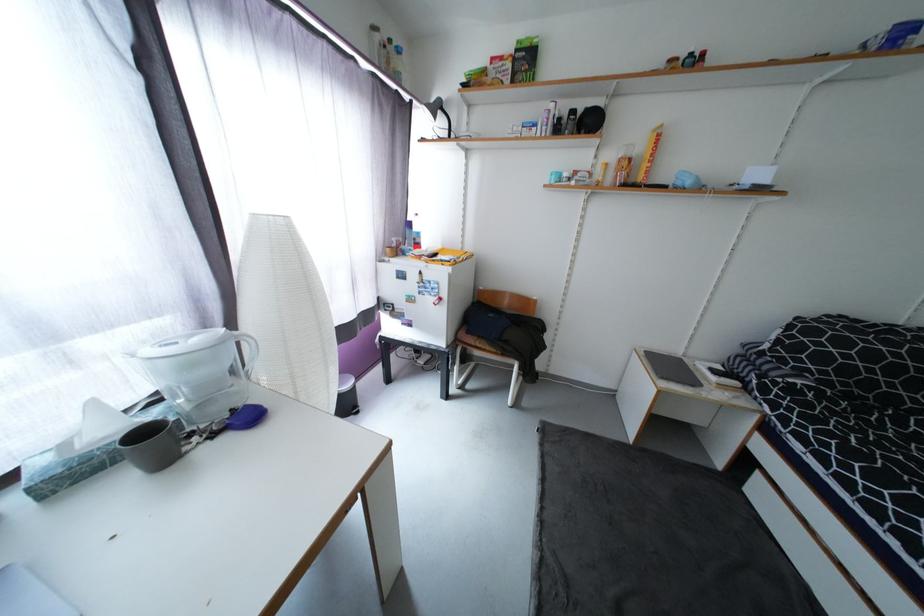
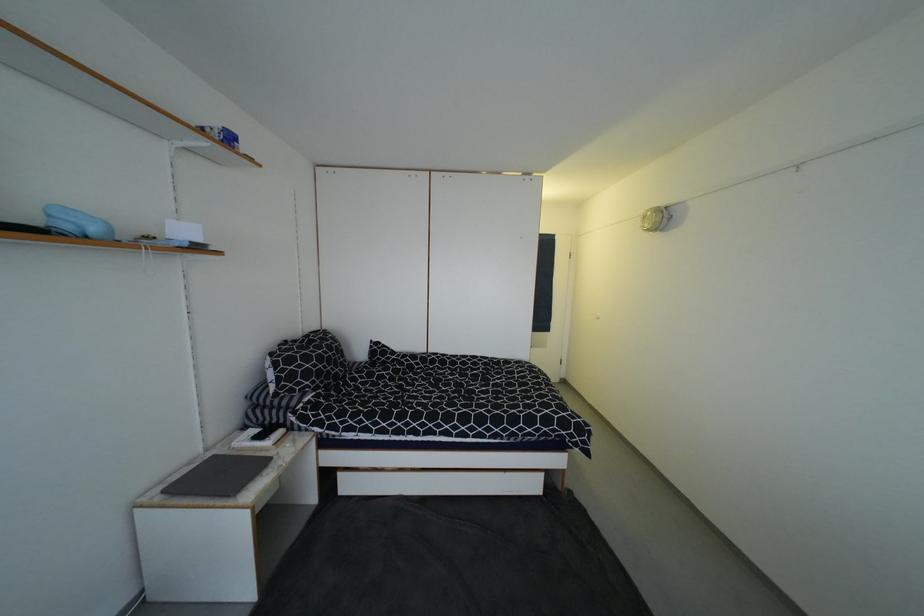
In the second image, find the point that corresponds to point (650, 353) in the first image.

(169, 493)